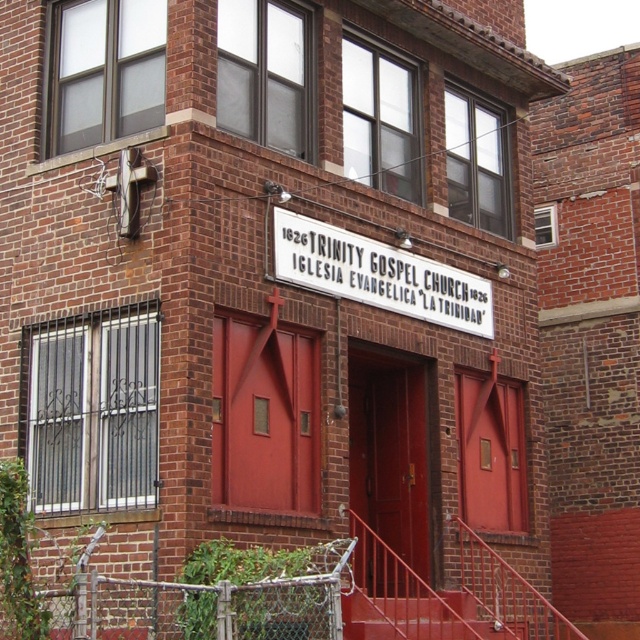
The width and height of the screenshot is (640, 640). What do you see at coordinates (193, 609) in the screenshot?
I see `chain-link fence at lower left` at bounding box center [193, 609].

Does chain-link fence at lower left come behind metallic red staircase at center?

That is False.

Does point (172, 596) come behind point (468, 611)?

That is False.

Where is `chain-link fence at lower left`? chain-link fence at lower left is located at coordinates (193, 609).

Does chain-link fence at lower left lie in front of white plastic sign at center?

Yes, it is in front of white plastic sign at center.

This screenshot has height=640, width=640. What do you see at coordinates (193, 609) in the screenshot?
I see `chain-link fence at lower left` at bounding box center [193, 609].

Identify the location of chain-link fence at lower left. [x=193, y=609].

Is white plastic sign at center behind metallic red staircase at center?

Yes, it is.

Locate an element on the screen. white plastic sign at center is located at coordinates (378, 275).

Where is `white plastic sign at center`? white plastic sign at center is located at coordinates (378, 275).